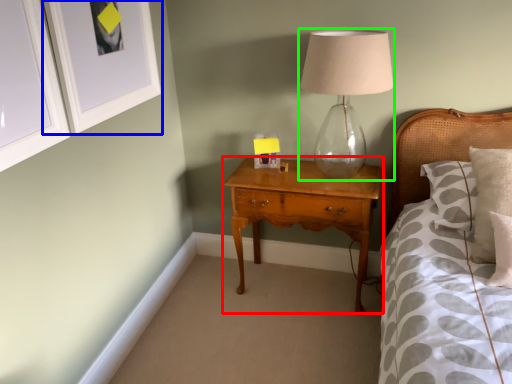
Question: Considering the real-world distances, which object is farthest from nightstand (highlighted by a red box)? picture frame (highlighted by a blue box) or table lamp (highlighted by a green box)?

Choices:
 (A) picture frame
 (B) table lamp

Answer: (A)